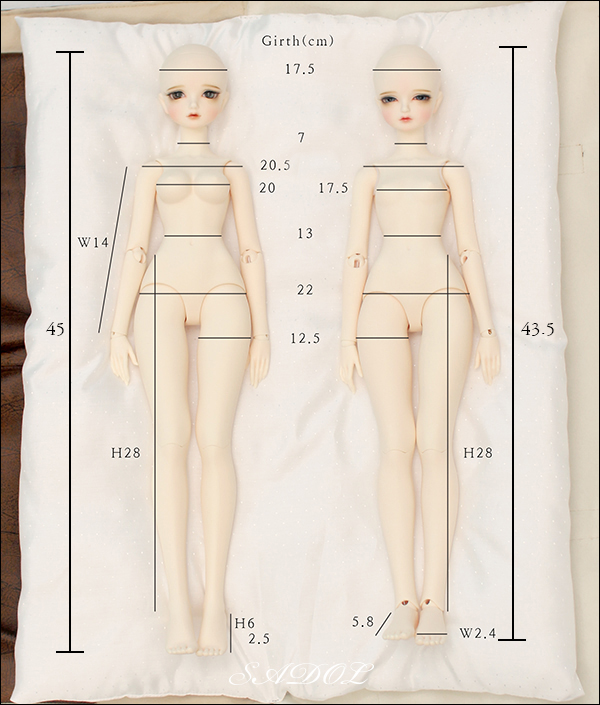
I want to click on dolls, so click(196, 237), click(412, 240).